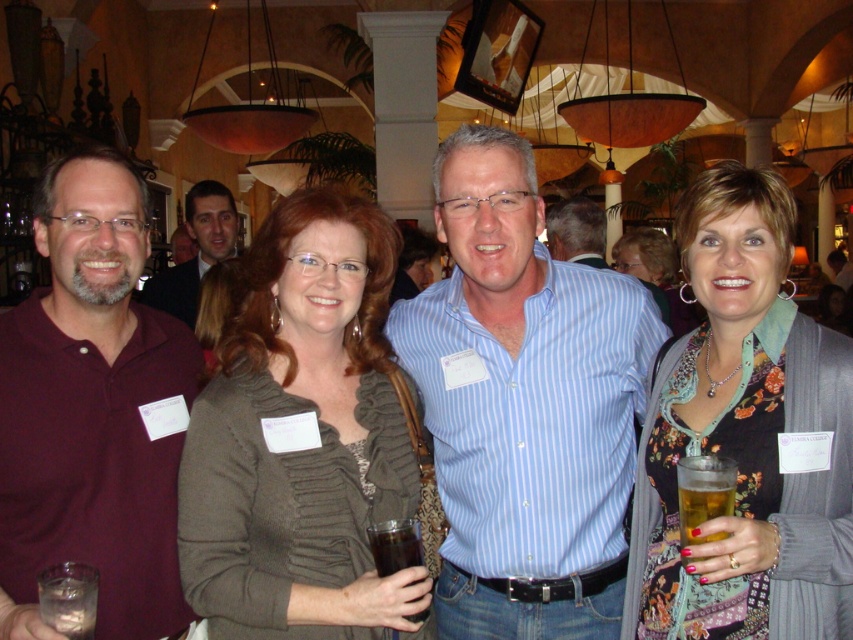
Which is above, maroon polo shirt at left or floral print dress at center?

floral print dress at center is higher up.

Between point (97, 241) and point (677, 292), which one is positioned in front?

Point (97, 241)

You are a GUI agent. You are given a task and a screenshot of the screen. Output one action in this format:
    pyautogui.click(x=<x>, y=<y>)
    Task: Click on the maroon polo shirt at left
    The width and height of the screenshot is (853, 640).
    Given the screenshot: What is the action you would take?
    pyautogui.click(x=91, y=410)

Where is `maroon polo shirt at left`? The width and height of the screenshot is (853, 640). maroon polo shirt at left is located at coordinates (91, 410).

Is golden amber liquid at lower right bigger than floral print dress at center?

Actually, golden amber liquid at lower right might be smaller than floral print dress at center.

Can you confirm if golden amber liquid at lower right is thinner than floral print dress at center?

Yes.

This screenshot has width=853, height=640. What do you see at coordinates (704, 496) in the screenshot? I see `golden amber liquid at lower right` at bounding box center [704, 496].

You are a GUI agent. You are given a task and a screenshot of the screen. Output one action in this format:
    pyautogui.click(x=<x>, y=<y>)
    Task: Click on the golden amber liquid at lower right
    Image resolution: width=853 pixels, height=640 pixels.
    Given the screenshot: What is the action you would take?
    pyautogui.click(x=704, y=496)

Who is taller, floral fabric dress at center or dark suit at center?

floral fabric dress at center

Which is below, floral fabric dress at center or dark suit at center?

floral fabric dress at center

The width and height of the screenshot is (853, 640). I want to click on floral fabric dress at center, so click(x=746, y=435).